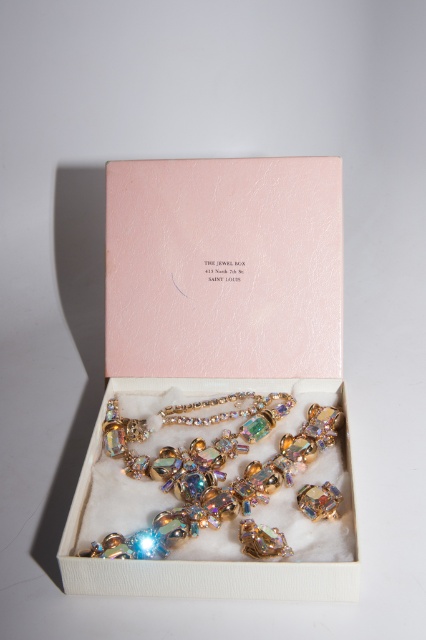
You are a customer at the store and want to know if the iridescent gold necklace at center can fit into the pink leather gift box at center. Based on their sizes, what do you think?

The pink leather gift box at center is wider than the iridescent gold necklace at center, so the necklace can fit inside the box.

You are a customer at a boutique store and see the pink leather gift box at center and the iridescent gold necklace at center displayed in the jewelry box. Which item is located more to the left?

The pink leather gift box at center is positioned on the left side of the iridescent gold necklace at center, so it is more to the left.